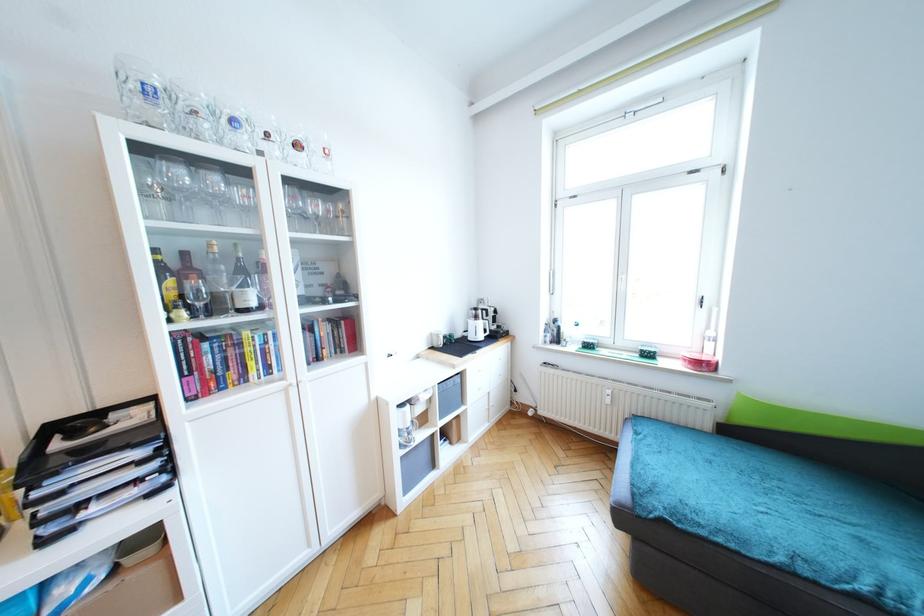
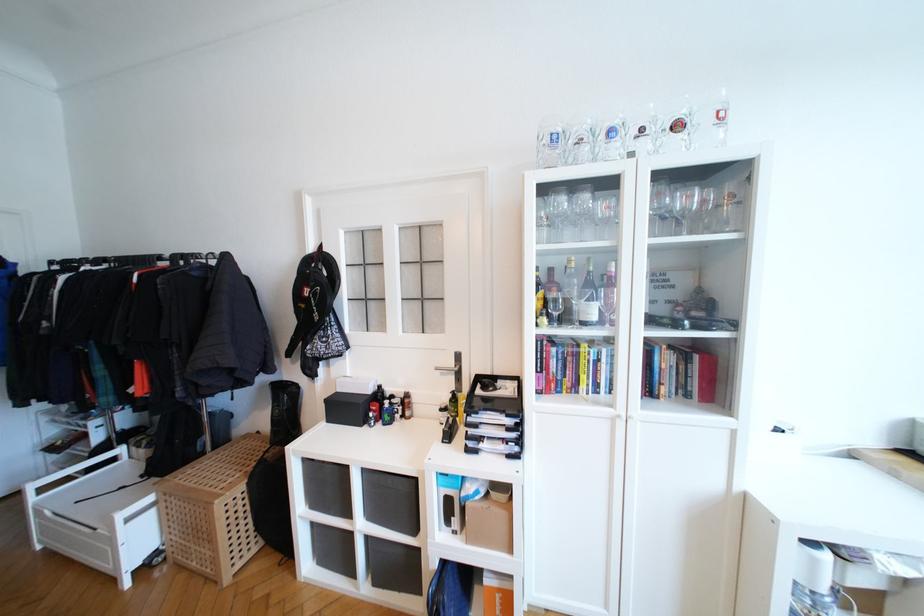
Where in the second image is the point corresponding to (x=116, y=585) from the first image?

(489, 506)